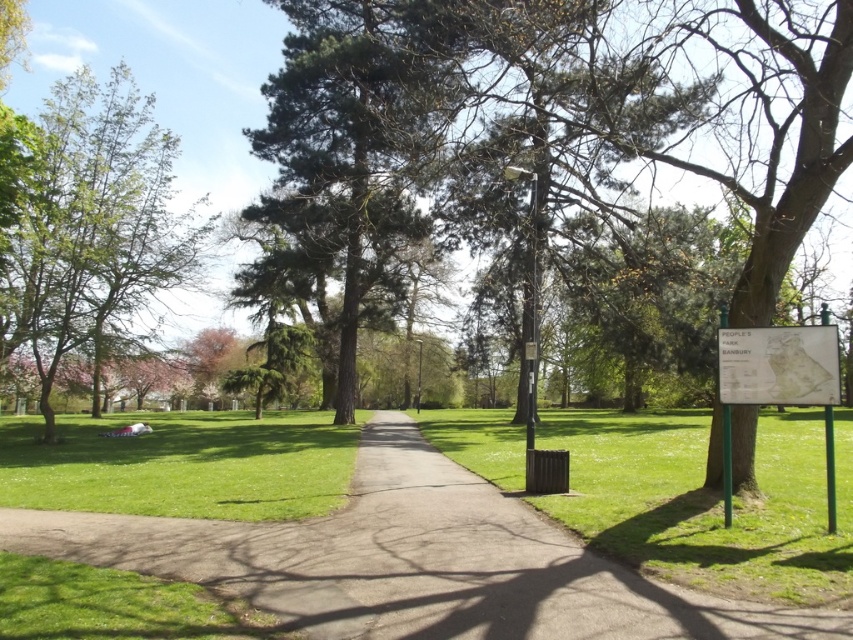
You are standing at the point labeled point (x=413, y=563) in the park. What type of surface are you standing on?

The point (x=413, y=563) is on smooth concrete path at center, so you are standing on a smooth concrete surface.

You are a gardener who needs to mow the green grass at center. The smooth concrete path at center is in the way. Which direction should you move the path to access the grass?

The smooth concrete path at center is to the left of green grass at center, so you should move it to the right to access the grass.